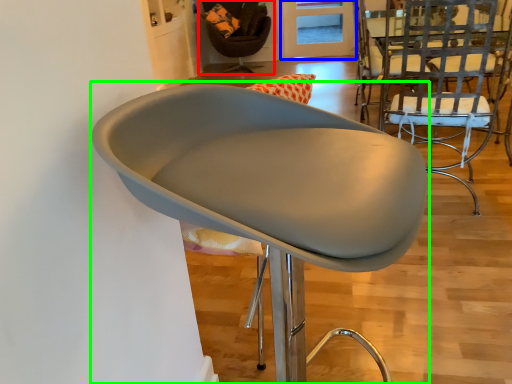
Question: Which object is positioned farthest from chair (highlighted by a red box)? Select from glass door (highlighted by a blue box) and chair (highlighted by a green box).

Choices:
 (A) glass door
 (B) chair

Answer: (B)